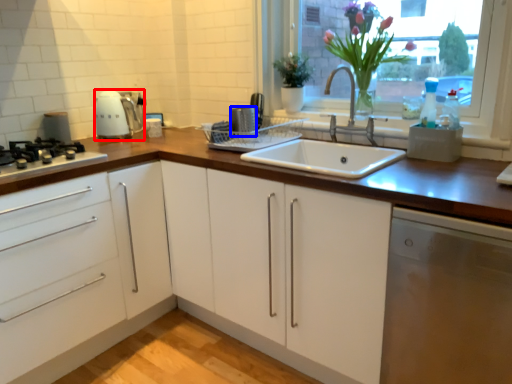
Question: Among these objects, which one is nearest to the camera, kitchen appliance (highlighted by a red box) or appliance (highlighted by a blue box)?

Choices:
 (A) kitchen appliance
 (B) appliance

Answer: (B)